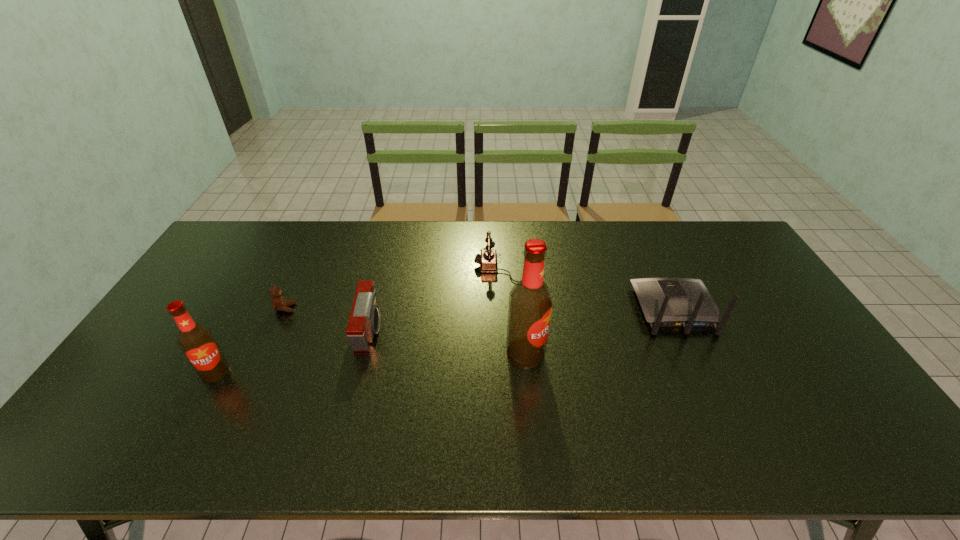
Please show where to add a beer bottle on the right while keeping spacing even. Please provide its 2D coordinates. Your answer should be formatted as a tuple, i.e. [(x, y)], where the tuple contains the x and y coordinates of a point satisfying the conditions above.

[(811, 336)]